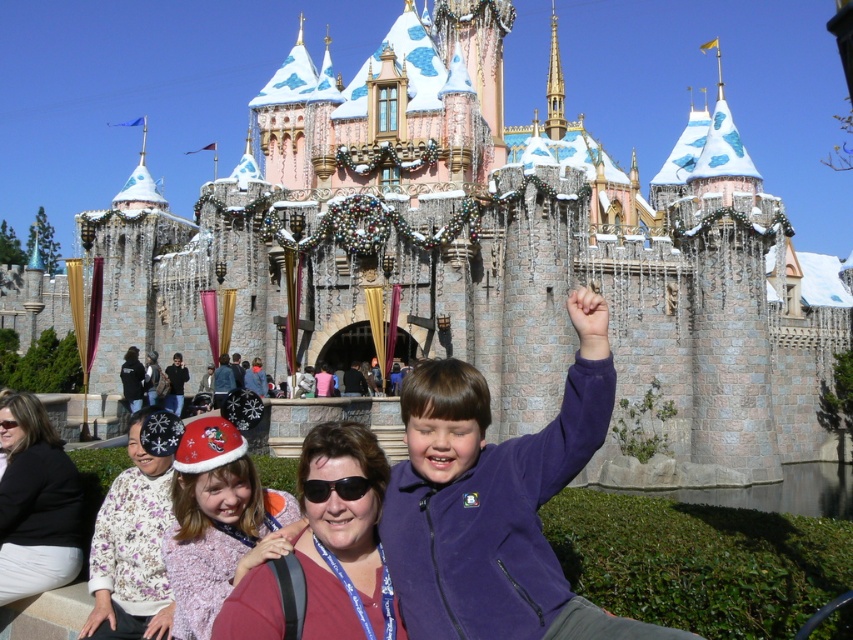
You are standing at the center of the image. There is a point marked at coordinates (495, 502). What object is located at that point?

The purple fleece jacket at center is located at point (495, 502).

You are a photographer at Disneyland today. You want to take a photo of the matte red shirt at center and the matte black jacket at lower left in the same frame. Based on their positions, which one should you focus on first to ensure both are in the shot?

Since the matte red shirt at center is to the right of the matte black jacket at lower left, you should focus on the matte black jacket at lower left first to capture both in the frame.

You are a photographer at Disneyland today. You want to take a photo of the purple fleece jacket at center and the fuzzy pink sweater at lower left so that both are visible in the frame. Based on their positions, which one should you focus on first to ensure both are in the shot?

The purple fleece jacket at center is positioned on the right side of the fuzzy pink sweater at lower left. To capture both in the frame, focus on the fuzzy pink sweater at lower left first, as it is on the left, allowing you to adjust the camera to include both the leftmost and rightmost subjects.